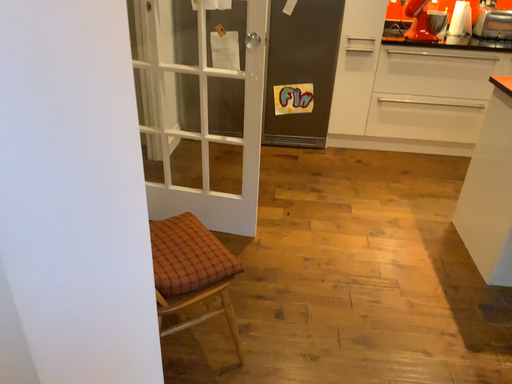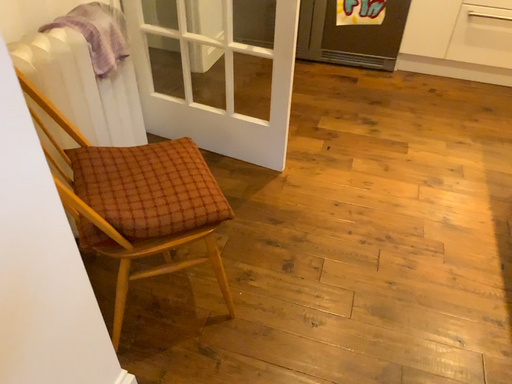
Question: Which way did the camera rotate in the video?

Choices:
 (A) rotated left
 (B) rotated right

Answer: (A)